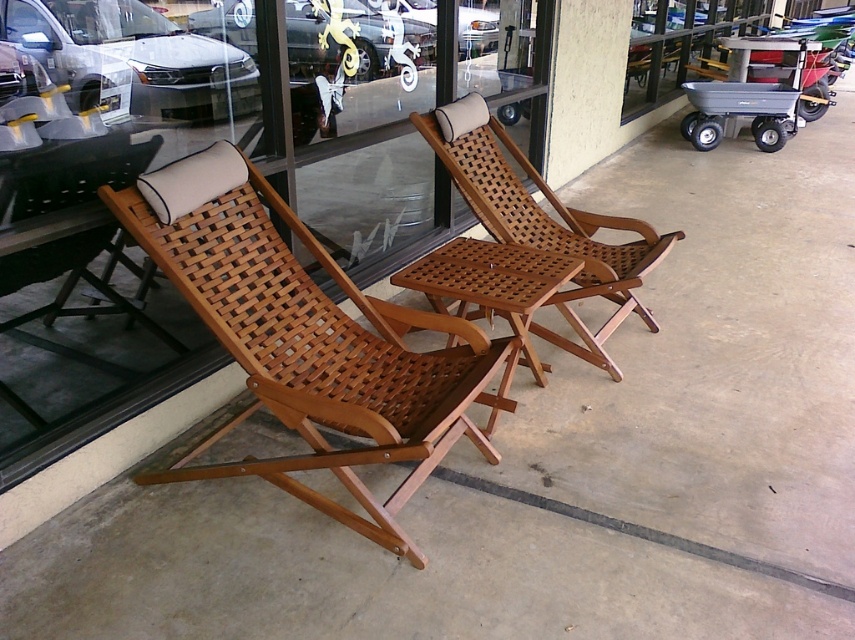
Which of these two, wooden woven chair at left or gray plastic cart at right, stands shorter?

Standing shorter between the two is gray plastic cart at right.

From the picture: Between wooden woven chair at left and gray plastic cart at right, which one is positioned lower?

wooden woven chair at left is below.

What do you see at coordinates (304, 339) in the screenshot? I see `wooden woven chair at left` at bounding box center [304, 339].

The height and width of the screenshot is (640, 855). Find the location of `wooden woven chair at left`. wooden woven chair at left is located at coordinates point(304,339).

Who is taller, transparent glass shop window at center or wooden woven chair at left?

With more height is transparent glass shop window at center.

Which is behind, point (461, 36) or point (391, 506)?

Positioned behind is point (461, 36).

Which is behind, point (99, 147) or point (317, 353)?

The point (99, 147) is behind.

Where is `transparent glass shop window at center`? The width and height of the screenshot is (855, 640). transparent glass shop window at center is located at coordinates (304, 99).

Can you confirm if transparent glass shop window at center is taller than wooden woven chair at center?

Correct, transparent glass shop window at center is much taller as wooden woven chair at center.

Can you confirm if transparent glass shop window at center is positioned above wooden woven chair at center?

Yes.

Which is in front, point (192, 337) or point (605, 225)?

Point (192, 337) is more forward.

The width and height of the screenshot is (855, 640). Find the location of `transparent glass shop window at center`. transparent glass shop window at center is located at coordinates (304, 99).